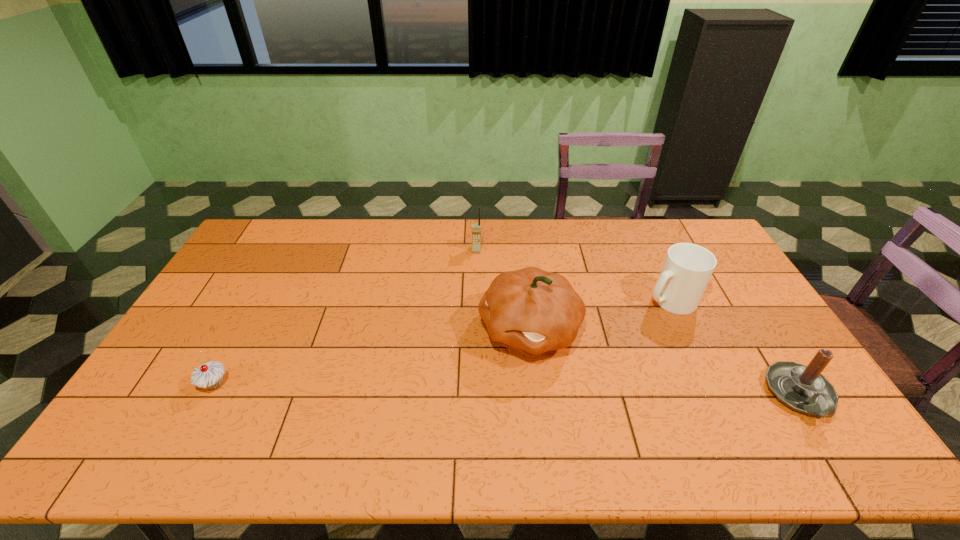
The image size is (960, 540). Find the location of `vacant space located on the front face of the tallest object`. vacant space located on the front face of the tallest object is located at coordinates click(x=429, y=401).

The width and height of the screenshot is (960, 540). I want to click on vacant space located on the front face of the tallest object, so click(478, 366).

I want to click on vacant space located 0.080m on the front face of the tallest object, so click(470, 372).

Identify the location of free location located on the front of the cellular telephone, where the keypad is located. (475, 264).

This screenshot has height=540, width=960. What are the coordinates of `free space located 0.080m on the front of the cellular telephone, where the keypad is located` in the screenshot? It's located at (475, 268).

At what (x,y) coordinates should I click in order to perform the action: click on vacant space situated 0.120m on the front of the cellular telephone, where the keypad is located. Please return your answer as a coordinate pair (x, y). Looking at the image, I should click on (474, 275).

This screenshot has height=540, width=960. Identify the location of object located in the far edge section of the desktop. pyautogui.click(x=476, y=227).

What are the coordinates of `cupcake that is at the near edge` in the screenshot? It's located at (210, 375).

At what (x,y) coordinates should I click in order to perform the action: click on candle that is at the near edge. Please return your answer as a coordinate pair (x, y). Looking at the image, I should click on (803, 388).

Locate an element on the screen. This screenshot has width=960, height=540. object positioned at the left edge is located at coordinates (210, 375).